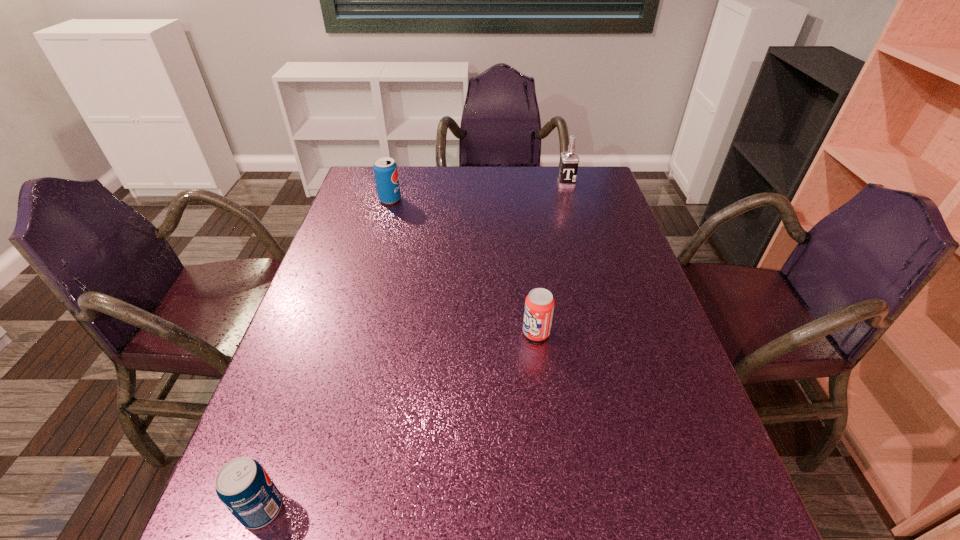
Point out which object is positioned as the second nearest to the rightmost soda can. Please provide its 2D coordinates. Your answer should be formatted as a tuple, i.e. [(x, y)], where the tuple contains the x and y coordinates of a point satisfying the conditions above.

[(385, 169)]

Locate an element on the screen. The width and height of the screenshot is (960, 540). the third closest object to the third object from left to right is located at coordinates (569, 161).

Select which soda can is the second closest to the third object from left to right. Please provide its 2D coordinates. Your answer should be formatted as a tuple, i.e. [(x, y)], where the tuple contains the x and y coordinates of a point satisfying the conditions above.

[(385, 169)]

Select which soda can appears as the closest to the second object from right to left. Please provide its 2D coordinates. Your answer should be formatted as a tuple, i.e. [(x, y)], where the tuple contains the x and y coordinates of a point satisfying the conditions above.

[(244, 487)]

Locate an element on the screen. The width and height of the screenshot is (960, 540). free space in the image that satisfies the following two spatial constraints: 1. on the front label of the rightmost object; 2. on the surface of the second nearest soda can is located at coordinates (609, 333).

The height and width of the screenshot is (540, 960). What are the coordinates of `free location that satisfies the following two spatial constraints: 1. on the front label of the rightmost object; 2. on the surface of the second nearest object` in the screenshot? It's located at (609, 333).

The width and height of the screenshot is (960, 540). In order to click on blank space that satisfies the following two spatial constraints: 1. on the front label of the farthest object; 2. on the surface of the second nearest object in this screenshot , I will do `click(609, 333)`.